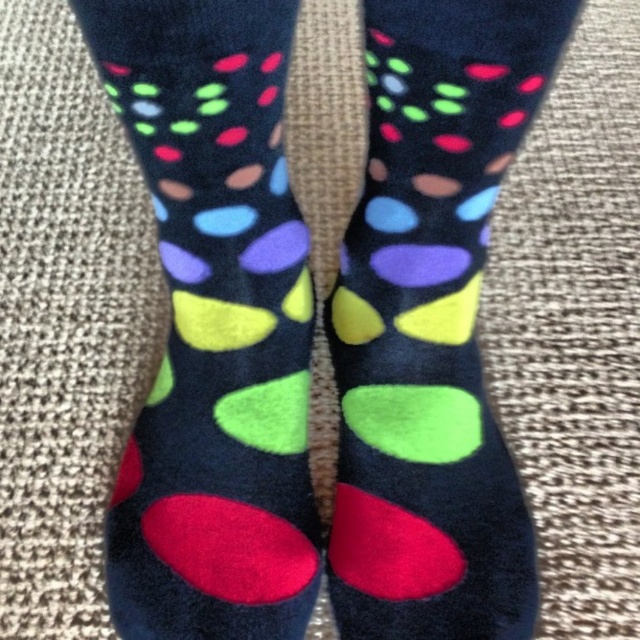
Based on the photo, is the position of fuzzy multicolored socks at center more distant than that of matte black socks at center?

That is False.

Between fuzzy multicolored socks at center and matte black socks at center, which one appears on the left side from the viewer's perspective?

Positioned to the left is fuzzy multicolored socks at center.

Identify the location of fuzzy multicolored socks at center. The height and width of the screenshot is (640, 640). (214, 326).

Find the location of a particular element. fuzzy multicolored socks at center is located at coordinates (214, 326).